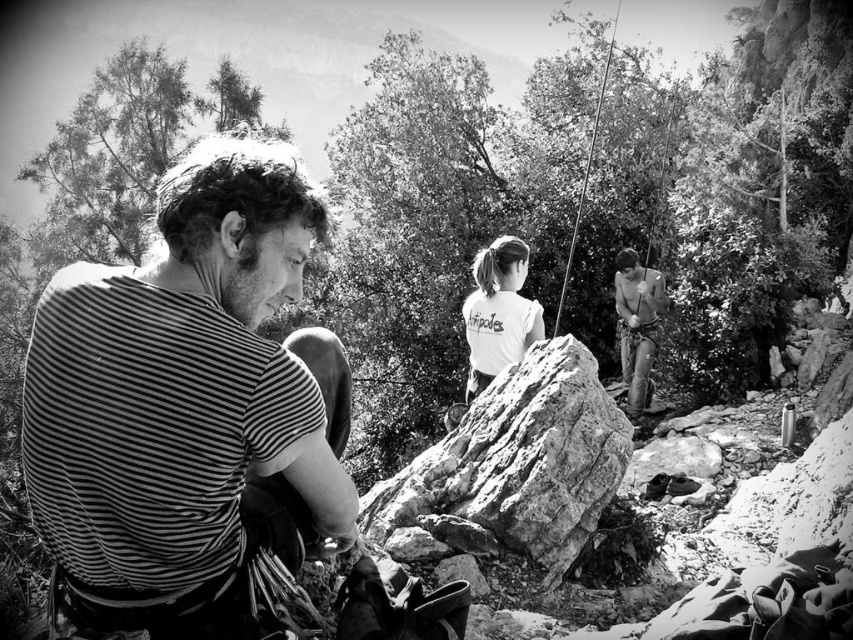
Question: Estimate the real-world distances between objects in this image. Which object is closer to the shiny metallic harness at center?

Choices:
 (A) rough textured rock at center
 (B) white cotton shirt at center

Answer: (B)

Question: Does white cotton shirt at center appear over shiny metallic harness at center?

Choices:
 (A) no
 (B) yes

Answer: (A)

Question: Estimate the real-world distances between objects in this image. Which object is closer to the shiny metallic harness at center?

Choices:
 (A) rough textured rock at center
 (B) white cotton shirt at center

Answer: (B)

Question: Where is striped fabric shirt at left located in relation to rough textured rock at center in the image?

Choices:
 (A) left
 (B) right

Answer: (A)

Question: Is striped fabric shirt at left bigger than shiny metallic harness at center?

Choices:
 (A) yes
 (B) no

Answer: (B)

Question: Among these points, which one is nearest to the camera?

Choices:
 (A) (474, 278)
 (B) (517, 436)

Answer: (B)